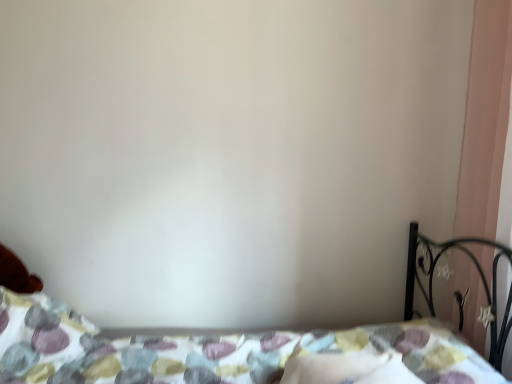
Question: Does white soft pillow at lower center appear on the right side of patterned fabric bed at lower center?

Choices:
 (A) yes
 (B) no

Answer: (A)

Question: Considering the relative sizes of white soft pillow at lower center and patterned fabric bed at lower center in the image provided, is white soft pillow at lower center wider than patterned fabric bed at lower center?

Choices:
 (A) yes
 (B) no

Answer: (B)

Question: Is white soft pillow at lower center far from patterned fabric bed at lower center?

Choices:
 (A) yes
 (B) no

Answer: (B)

Question: Is white soft pillow at lower center directly adjacent to patterned fabric bed at lower center?

Choices:
 (A) yes
 (B) no

Answer: (B)

Question: Does white soft pillow at lower center have a lesser height compared to patterned fabric bed at lower center?

Choices:
 (A) yes
 (B) no

Answer: (A)

Question: Is white soft pillow at lower center smaller than patterned fabric bed at lower center?

Choices:
 (A) yes
 (B) no

Answer: (A)

Question: Does white soft pillow at lower center lie in front of pink matte curtain at right?

Choices:
 (A) no
 (B) yes

Answer: (A)

Question: Does white soft pillow at lower center have a lesser height compared to pink matte curtain at right?

Choices:
 (A) yes
 (B) no

Answer: (A)

Question: From a real-world perspective, is white soft pillow at lower center under pink matte curtain at right?

Choices:
 (A) no
 (B) yes

Answer: (B)

Question: Considering the relative sizes of white soft pillow at lower center and pink matte curtain at right in the image provided, is white soft pillow at lower center bigger than pink matte curtain at right?

Choices:
 (A) no
 (B) yes

Answer: (A)

Question: Considering the relative sizes of white soft pillow at lower center and pink matte curtain at right in the image provided, is white soft pillow at lower center taller than pink matte curtain at right?

Choices:
 (A) yes
 (B) no

Answer: (B)

Question: From the image's perspective, is white soft pillow at lower center beneath pink matte curtain at right?

Choices:
 (A) yes
 (B) no

Answer: (A)

Question: From a real-world perspective, is pink matte curtain at right physically below patterned fabric bed at lower center?

Choices:
 (A) no
 (B) yes

Answer: (A)